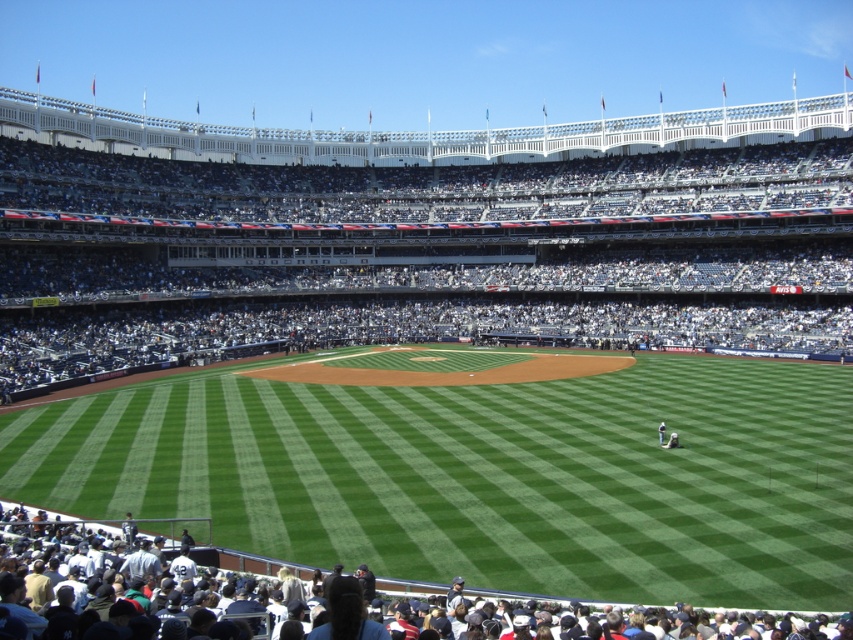
You are a photographer standing at the edge of the infield dirt. You want to take a photo that includes both the green grass at center and the white cotton shirt at lower center. Which object should be placed closer to the camera to ensure both are in focus?

The green grass at center is much taller than the white cotton shirt at lower center. To ensure both are in focus, the photographer should place the taller green grass at center closer to the camera since it is taller and needs to be within the depth of field range.

You are a photographer standing at the center of the baseball stadium. You want to take a photo that includes both the point at coordinates point [318,486] and point [3,516]. Which point will appear closer to the bottom edge of your photo?

Point [3,516] will appear closer to the bottom edge of the photo because it is closer to the camera than point [318,486], making it positioned lower in the frame.